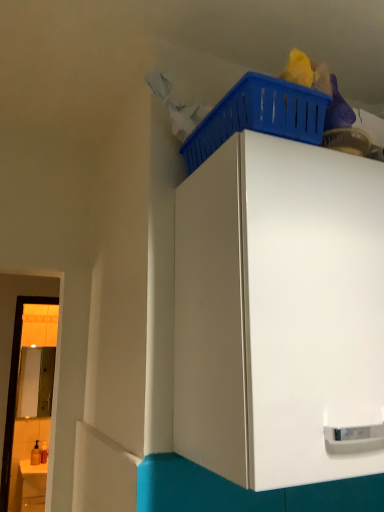
Describe the element at coordinates (32, 486) in the screenshot. I see `matte white counter at lower left` at that location.

What do you see at coordinates (259, 116) in the screenshot? This screenshot has width=384, height=512. I see `blue plastic basket at upper right` at bounding box center [259, 116].

Locate an element on the screen. This screenshot has height=512, width=384. white glossy cabinet at upper center is located at coordinates (278, 312).

Find the location of a particular element. basket on the right of matte white counter at lower left is located at coordinates (259, 116).

Is matte white counter at lower left positioned behind blue plastic basket at upper right?

Yes, it is.

Which is in front, point (30, 468) or point (230, 122)?

The point (230, 122) is closer to the camera.

Is matte white counter at lower left next to blue plastic basket at upper right?

There is a gap between matte white counter at lower left and blue plastic basket at upper right.

Considering the relative sizes of white glossy cabinet at upper center and matte white counter at lower left in the image provided, is white glossy cabinet at upper center shorter than matte white counter at lower left?

Incorrect, the height of white glossy cabinet at upper center does not fall short of that of matte white counter at lower left.

Is white glossy cabinet at upper center to the right of matte white counter at lower left from the viewer's perspective?

Correct, you'll find white glossy cabinet at upper center to the right of matte white counter at lower left.

Can you tell me how much white glossy cabinet at upper center and matte white counter at lower left differ in facing direction?

The angle between the facing direction of white glossy cabinet at upper center and the facing direction of matte white counter at lower left is 0.472 degrees.

Is white glossy cabinet at upper center aimed at matte white counter at lower left?

No, white glossy cabinet at upper center is not aimed at matte white counter at lower left.

Which is behind, white glossy cabinet at upper center or blue plastic basket at upper right?

blue plastic basket at upper right is further from the camera.

Is blue plastic basket at upper right completely or partially inside white glossy cabinet at upper center?

No, blue plastic basket at upper right is located outside of white glossy cabinet at upper center.

Is white glossy cabinet at upper center facing away from blue plastic basket at upper right?

No, white glossy cabinet at upper center's orientation is not away from blue plastic basket at upper right.

Can white glossy cabinet at upper center be found inside blue plastic basket at upper right?

Actually, white glossy cabinet at upper center is outside blue plastic basket at upper right.

Can you confirm if blue plastic basket at upper right is thinner than white glossy cabinet at upper center?

Yes.

Is blue plastic basket at upper right next to white glossy cabinet at upper center and touching it?

No, blue plastic basket at upper right is not beside white glossy cabinet at upper center.

Does point (244, 93) appear closer or farther from the camera than point (222, 207)?

Clearly, point (244, 93) is closer to the camera than point (222, 207).

What's the angular difference between matte white counter at lower left and white glossy cabinet at upper center's facing directions?

0.472 degrees.

Looking at this image, which of these two, matte white counter at lower left or white glossy cabinet at upper center, stands shorter?

With less height is matte white counter at lower left.

Would you say matte white counter at lower left is outside white glossy cabinet at upper center?

Yes, matte white counter at lower left is not within white glossy cabinet at upper center.

From a real-world perspective, between matte white counter at lower left and white glossy cabinet at upper center, who is vertically lower?

From a 3D spatial view, matte white counter at lower left is below.

How distant is blue plastic basket at upper right from matte white counter at lower left?

blue plastic basket at upper right is 3.29 meters from matte white counter at lower left.

From the image's perspective, is blue plastic basket at upper right located beneath matte white counter at lower left?

Incorrect, from the image's perspective, blue plastic basket at upper right is higher than matte white counter at lower left.

Would you consider blue plastic basket at upper right to be distant from matte white counter at lower left?

Yes.

The width and height of the screenshot is (384, 512). Identify the location of basket that appears on the right of matte white counter at lower left. (259, 116).

Where is `counter on the left of the white glossy cabinet at upper center`? counter on the left of the white glossy cabinet at upper center is located at coordinates (32, 486).

Based on their spatial positions, is white glossy cabinet at upper center or blue plastic basket at upper right closer to matte white counter at lower left?

white glossy cabinet at upper center lies closer to matte white counter at lower left than the other object.

Based on their spatial positions, is blue plastic basket at upper right or matte white counter at lower left closer to white glossy cabinet at upper center?

blue plastic basket at upper right is positioned closer to the anchor white glossy cabinet at upper center.

Which object lies nearer to the anchor point white glossy cabinet at upper center, matte white counter at lower left or blue plastic basket at upper right?

Based on the image, blue plastic basket at upper right appears to be nearer to white glossy cabinet at upper center.

From the image, which object appears to be nearer to blue plastic basket at upper right, white glossy cabinet at upper center or matte white counter at lower left?

white glossy cabinet at upper center is closer to blue plastic basket at upper right.

Estimate the real-world distances between objects in this image. Which object is further from blue plastic basket at upper right, matte white counter at lower left or white glossy cabinet at upper center?

Among the two, matte white counter at lower left is located further to blue plastic basket at upper right.

Based on their spatial positions, is blue plastic basket at upper right or white glossy cabinet at upper center further from matte white counter at lower left?

blue plastic basket at upper right.

Identify the location of basket between white glossy cabinet at upper center and matte white counter at lower left along the z-axis. This screenshot has width=384, height=512. (259, 116).